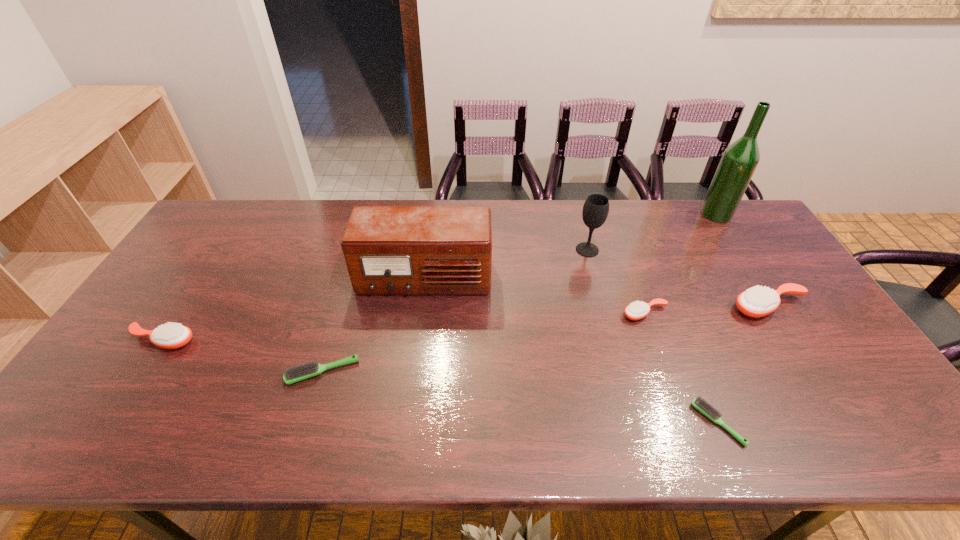
The height and width of the screenshot is (540, 960). In the image, there is a desktop. Find the location of `vacant space at the left edge`. vacant space at the left edge is located at coordinates (206, 254).

Find the location of a particular element. free space at the right edge is located at coordinates (726, 241).

I want to click on vacant space at the far left corner, so click(x=239, y=207).

Where is `free space at the near right corner of the desktop`? The height and width of the screenshot is (540, 960). free space at the near right corner of the desktop is located at coordinates (881, 426).

You are a GUI agent. You are given a task and a screenshot of the screen. Output one action in this format:
    pyautogui.click(x=<x>, y=<y>)
    Task: Click on the free area in between the smallest orange hairbrush and the alcohol
    
    Given the screenshot: What is the action you would take?
    pyautogui.click(x=681, y=264)

Where is `unoccupied area between the second shortest object and the rightmost hairbrush`? Image resolution: width=960 pixels, height=540 pixels. unoccupied area between the second shortest object and the rightmost hairbrush is located at coordinates (546, 339).

Identify the location of free spot between the fifth object from right to left and the second orange hairbrush from left to right. (616, 282).

The image size is (960, 540). Find the location of `vacant area that lies between the biggest orange hairbrush and the wineglass`. vacant area that lies between the biggest orange hairbrush and the wineglass is located at coordinates (678, 279).

You are a GUI agent. You are given a task and a screenshot of the screen. Output one action in this format:
    pyautogui.click(x=<x>, y=<y>)
    Task: Click on the vacant space that is in between the leftmost hairbrush and the wineglass
    The width and height of the screenshot is (960, 540).
    Given the screenshot: What is the action you would take?
    pyautogui.click(x=375, y=295)

Locate an element on the screen. Image resolution: width=960 pixels, height=540 pixels. empty space between the biggest orange hairbrush and the second orange hairbrush from right to left is located at coordinates (707, 310).